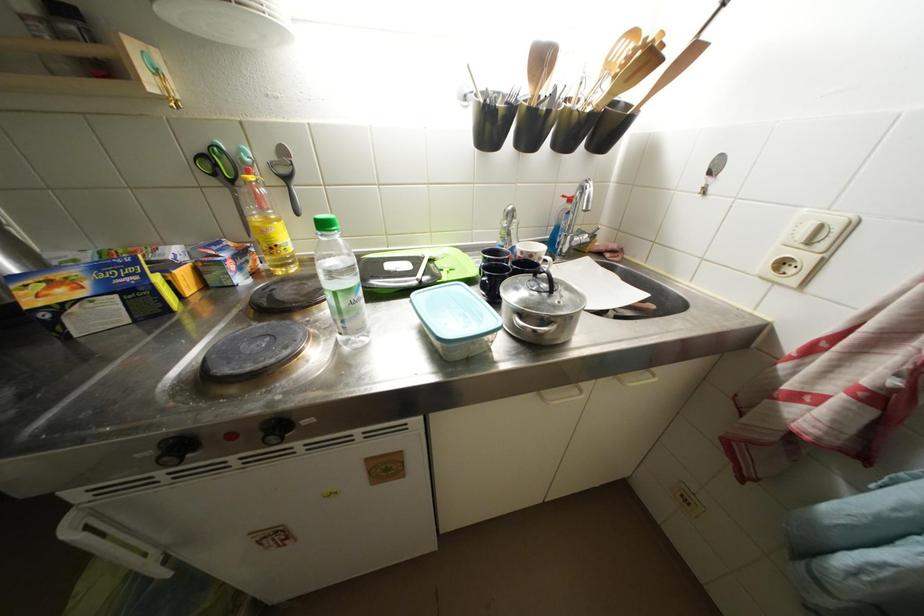
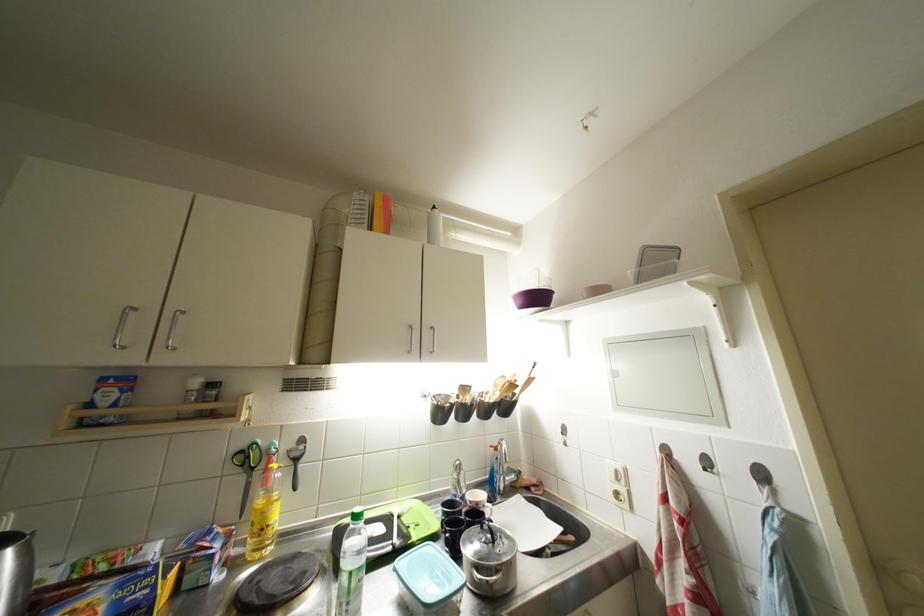
Where in the second image is the point corresponding to the point at 418,305 from the first image?

(402, 573)